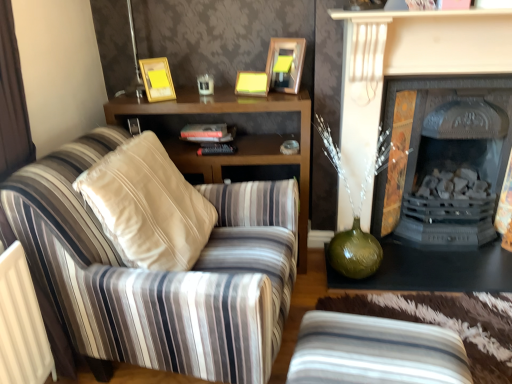
Identify the location of vacant space situated on the left part of gold metallic picture frame at upper center, which ranks as the second picture frame in right-to-left order. (128, 100).